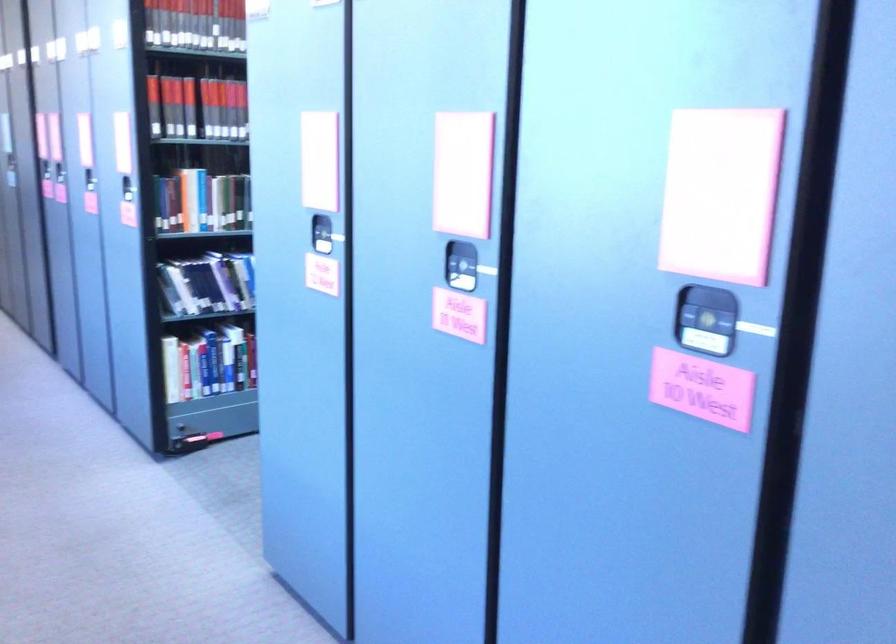
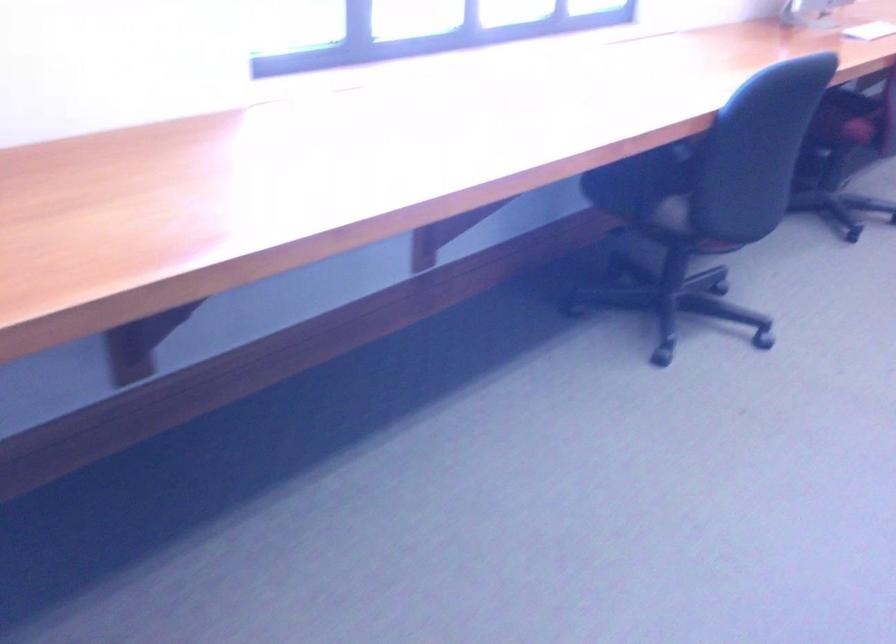
The first image is from the beginning of the video and the second image is from the end. How did the camera likely rotate when shooting the video?

The camera's rotation is toward left-down.